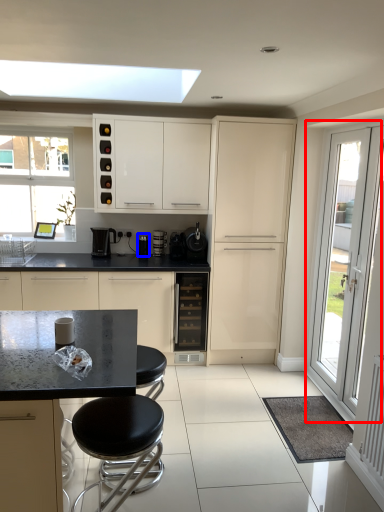
Question: Which of the following is the farthest to the observer, door (highlighted by a red box) or appliance (highlighted by a blue box)?

Choices:
 (A) door
 (B) appliance

Answer: (B)